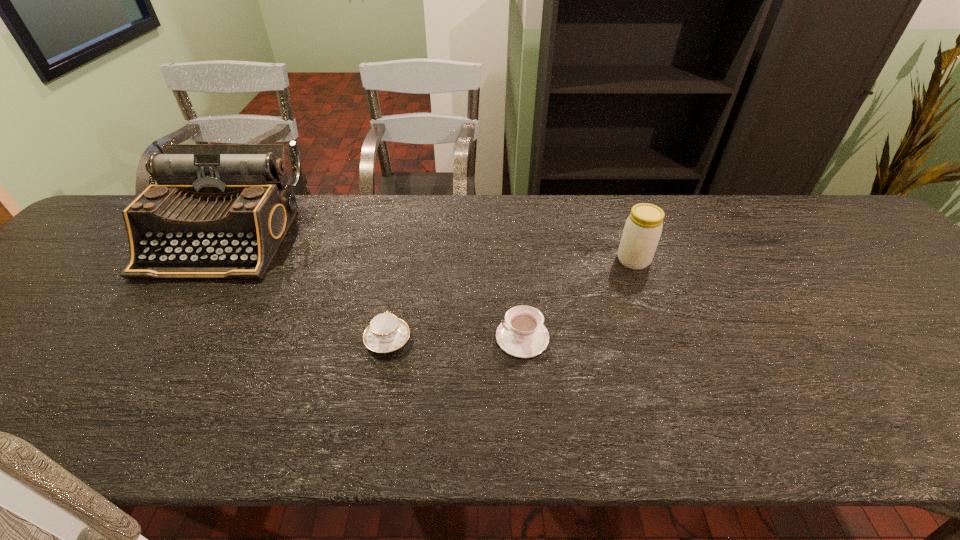
The image size is (960, 540). I want to click on typewriter, so coord(218,211).

Where is `the leftmost object`? the leftmost object is located at coordinates (218, 211).

Where is `the rightmost object`? the rightmost object is located at coordinates (643, 228).

At what (x,y) coordinates should I click in order to perform the action: click on jar. Please return your answer as a coordinate pair (x, y). This screenshot has height=540, width=960. Looking at the image, I should click on (643, 228).

What are the coordinates of `the right teacup` in the screenshot? It's located at [x=522, y=334].

This screenshot has width=960, height=540. I want to click on the shortest object, so click(x=386, y=333).

Locate an element on the screen. the second object from left to right is located at coordinates (386, 333).

At what (x,y) coordinates should I click in order to perform the action: click on vacant space situated 0.210m on the keyboard of the typewriter. Please return your answer as a coordinate pair (x, y). This screenshot has height=540, width=960. Looking at the image, I should click on (147, 348).

Find the location of a particular element. The image size is (960, 540). free space located 0.110m on the left of the rightmost object is located at coordinates (575, 260).

You are a GUI agent. You are given a task and a screenshot of the screen. Output one action in this format:
    pyautogui.click(x=<x>, y=<y>)
    Task: Click on the free spot located 0.140m on the handle side of the third object from left to right
    The width and height of the screenshot is (960, 540).
    Given the screenshot: What is the action you would take?
    pyautogui.click(x=433, y=337)